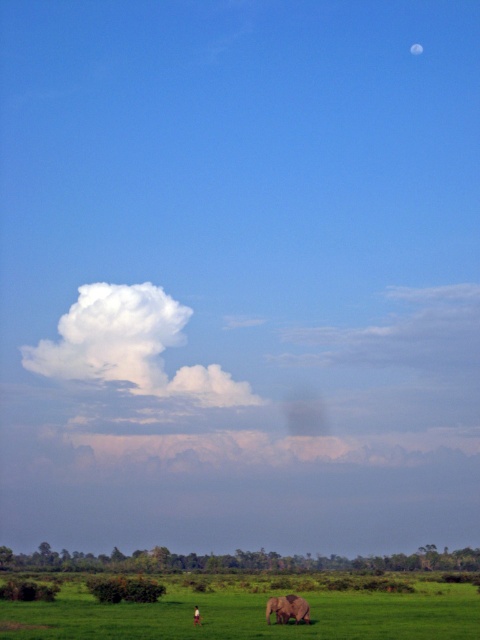
Which is more to the left, white fluffy cloud at upper center or gray matte elephant at lower center?

From the viewer's perspective, white fluffy cloud at upper center appears more on the left side.

Which of these two, white fluffy cloud at upper center or gray matte elephant at lower center, stands shorter?

gray matte elephant at lower center is shorter.

Find the location of a particular element. The image size is (480, 640). white fluffy cloud at upper center is located at coordinates (131, 348).